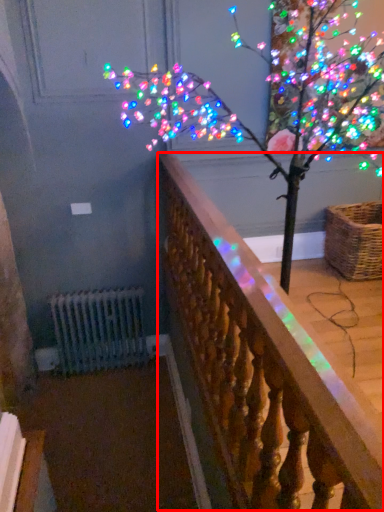
Question: From the image's perspective, where is rail (annotated by the red box) located relative to basket?

Choices:
 (A) above
 (B) below

Answer: (B)